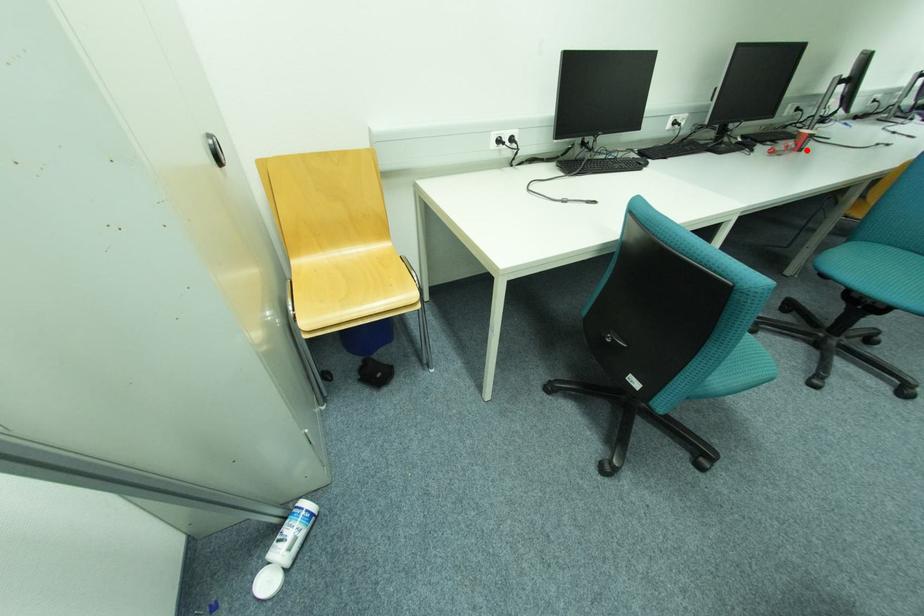
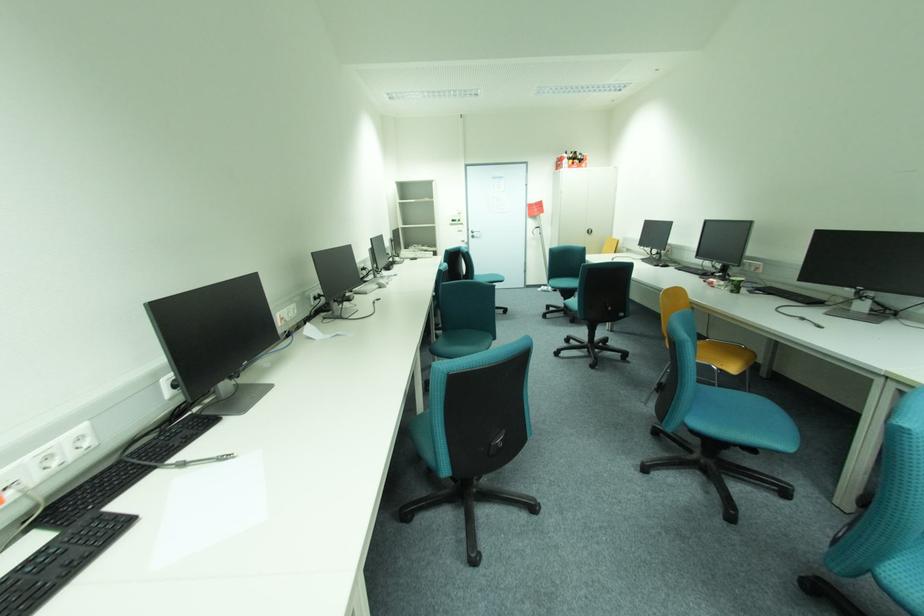
Locate, in the second image, the point that corresponds to the highlighted location in the first image.

(738, 292)